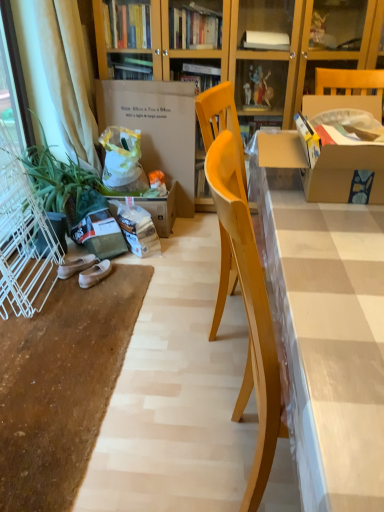
Question: Should I look upward or downward to see beige fabric curtain at left?

Choices:
 (A) up
 (B) down

Answer: (A)

Question: From a real-world perspective, is white cardboard box at center physically below white suede shoes at lower left, which is counted as the 2th footwear, starting from the left?

Choices:
 (A) yes
 (B) no

Answer: (B)

Question: Does white cardboard box at center have a lesser height compared to white suede shoes at lower left, the 1th footwear positioned from the right?

Choices:
 (A) yes
 (B) no

Answer: (B)

Question: Is white cardboard box at center taller than white suede shoes at lower left, which is counted as the 2th footwear, starting from the left?

Choices:
 (A) no
 (B) yes

Answer: (B)

Question: Is white cardboard box at center touching white suede shoes at lower left, which is counted as the 2th footwear, starting from the left?

Choices:
 (A) no
 (B) yes

Answer: (A)

Question: Is white cardboard box at center in front of white suede shoes at lower left, the 1th footwear positioned from the right?

Choices:
 (A) no
 (B) yes

Answer: (A)

Question: Can you confirm if white cardboard box at center is positioned to the left of white suede shoes at lower left, the 1th footwear positioned from the right?

Choices:
 (A) yes
 (B) no

Answer: (B)

Question: Is matte cardboard desk at center wider than beige suede shoes at lower left, which is the second footwear from right to left?

Choices:
 (A) no
 (B) yes

Answer: (B)

Question: Is matte cardboard desk at center taller than beige suede shoes at lower left, acting as the first footwear starting from the left?

Choices:
 (A) no
 (B) yes

Answer: (B)

Question: Is matte cardboard desk at center completely or partially outside of beige suede shoes at lower left, acting as the first footwear starting from the left?

Choices:
 (A) no
 (B) yes

Answer: (B)

Question: Is matte cardboard desk at center next to beige suede shoes at lower left, acting as the first footwear starting from the left?

Choices:
 (A) no
 (B) yes

Answer: (A)

Question: From a real-world perspective, is matte cardboard desk at center under beige suede shoes at lower left, acting as the first footwear starting from the left?

Choices:
 (A) yes
 (B) no

Answer: (B)

Question: Can you confirm if matte cardboard desk at center is shorter than beige suede shoes at lower left, acting as the first footwear starting from the left?

Choices:
 (A) yes
 (B) no

Answer: (B)

Question: Is white suede shoes at lower left, the 1th footwear positioned from the right, at the right side of beige fabric curtain at left?

Choices:
 (A) no
 (B) yes

Answer: (B)